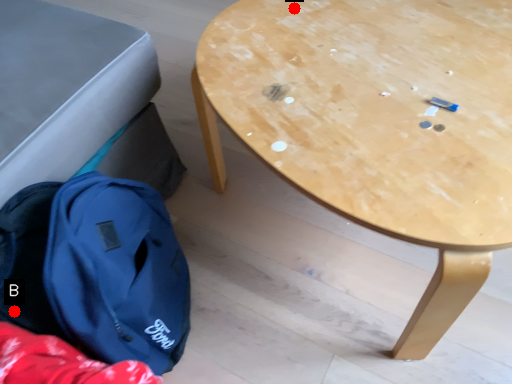
Question: Two points are circled on the image, labeled by A and B beside each circle. Which point is farther to the camera?

Choices:
 (A) A is further
 (B) B is further

Answer: (A)